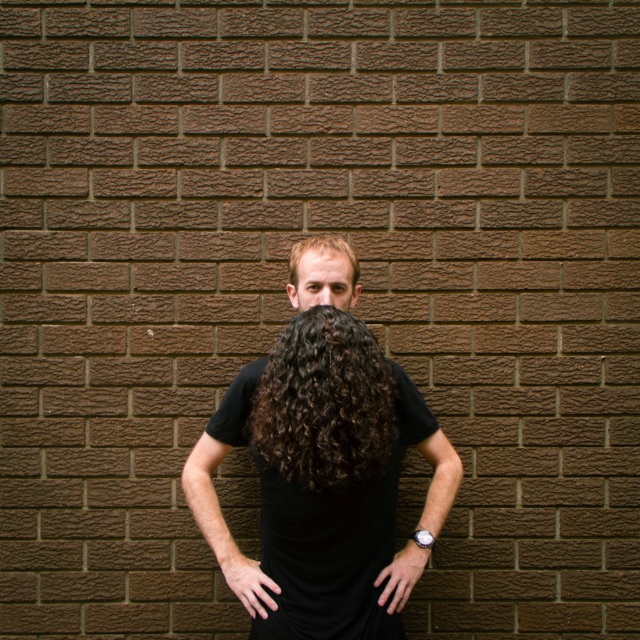
You are a photographer trying to place a sticker exactly at the point with coordinates (323, 477) on the person in the image. According to the scene description, where should you place the sticker?

The point with coordinates (323, 477) is on the black matte t shirt at center, so place the sticker on the black matte t shirt at center.